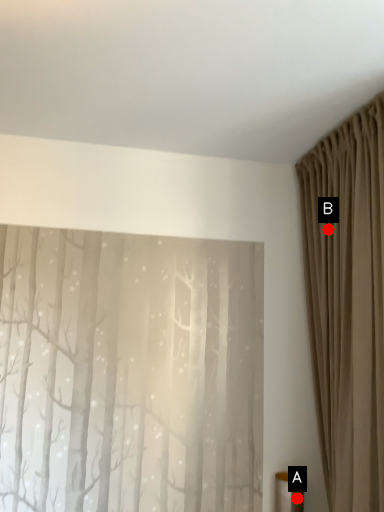
Question: Two points are circled on the image, labeled by A and B beside each circle. Which point is farther to the camera?

Choices:
 (A) A is further
 (B) B is further

Answer: (A)